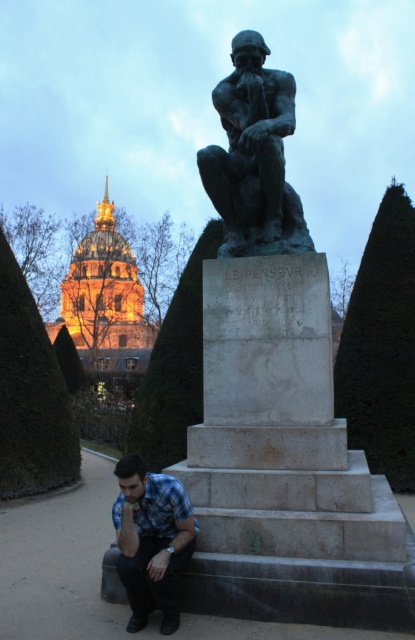
Looking at this image, you are standing in front of the Le Penseur sculpture and notice a specific point marked at coordinates point (x=409, y=460). If you want to reach this point without moving your feet, can you physically touch it with your outstretched hand?

The point (x=409, y=460) is 45.45 feet away from the viewer, which is much farther than the average human arm length, so you cannot physically touch it without moving your feet.

You are standing in front of the Le Penseur sculpture and notice two points marked in the scene. The first point is at coordinate point (400, 252) and the second is at point (9, 244). Which point is closer to you?

Point (400, 252) is closer to the viewer than point (9, 244).

You are a gardener who needs to trim the green leafy hedge at left and the green leafy hedge at center. The law states that hedges must be spaced at least 3 meters apart for proper growth. Are these hedges compliant with the law?

The green leafy hedge at left and green leafy hedge at center are 2.72 meters apart from each other, which is less than the required 3 meters. Therefore, they are not compliant with the law.